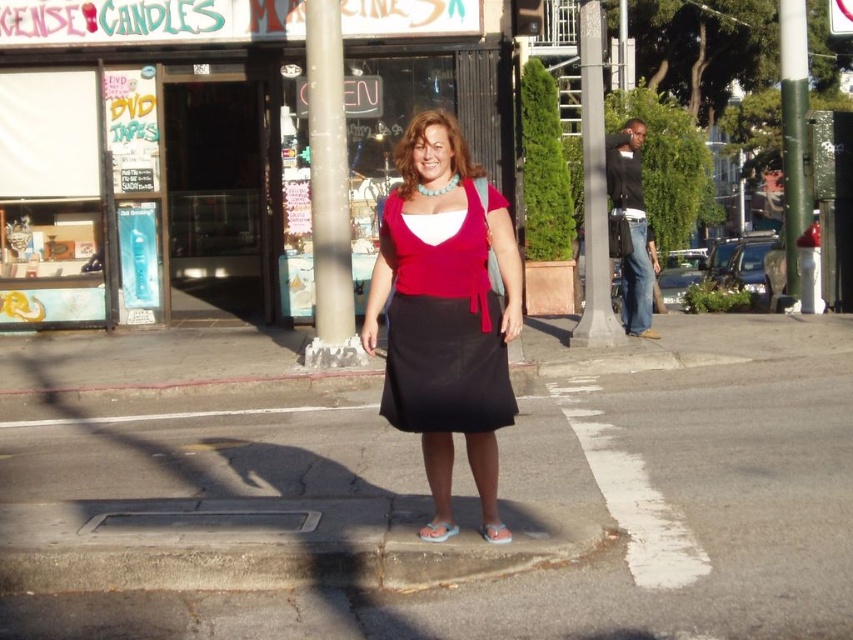
Question: Considering the real-world distances, which object is farthest from the matte red blouse at center?

Choices:
 (A) black asphalt at center
 (B) matte red dress at center

Answer: (A)

Question: Which object appears farthest from the camera in this image?

Choices:
 (A) black asphalt at center
 (B) matte red blouse at center

Answer: (B)

Question: Where is black asphalt at center located in relation to matte red blouse at center in the image?

Choices:
 (A) left
 (B) right

Answer: (B)

Question: Does black asphalt at center appear on the left side of matte red blouse at center?

Choices:
 (A) no
 (B) yes

Answer: (A)

Question: Does black asphalt at center appear under matte red dress at center?

Choices:
 (A) yes
 (B) no

Answer: (A)

Question: Which object is positioned closest to the matte red blouse at center?

Choices:
 (A) black asphalt at center
 (B) matte red dress at center

Answer: (B)